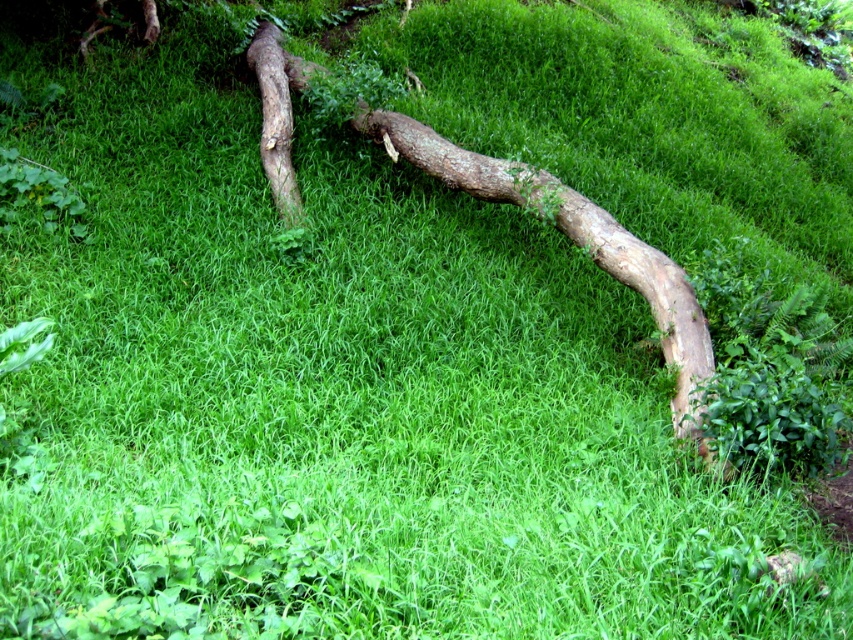
Question: Which object is farther from the camera taking this photo?

Choices:
 (A) brown rough tree trunk at upper left
 (B) brown rough wood at center

Answer: (A)

Question: Is brown rough wood at center behind brown rough tree trunk at upper left?

Choices:
 (A) no
 (B) yes

Answer: (A)

Question: In this image, where is brown rough wood at center located relative to brown rough tree trunk at upper left?

Choices:
 (A) above
 (B) below

Answer: (B)

Question: Among these points, which one is farthest from the camera?

Choices:
 (A) (276, 76)
 (B) (698, 323)

Answer: (A)

Question: Is brown rough wood at center above brown rough tree trunk at upper left?

Choices:
 (A) yes
 (B) no

Answer: (B)